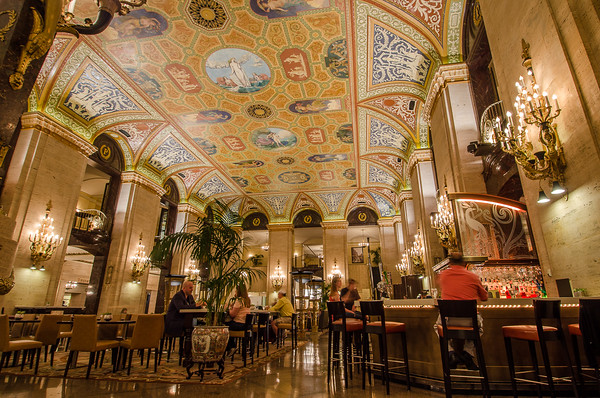
The width and height of the screenshot is (600, 398). In order to click on bar in this screenshot , I will do `click(511, 285)`.